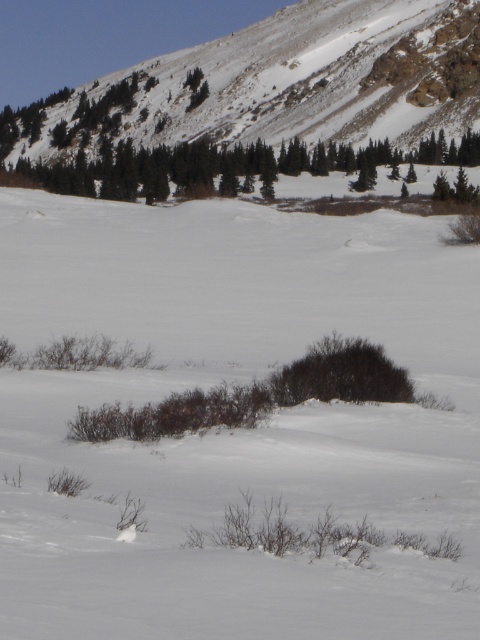
You are standing at the origin point in the winter landscape. You see two points marked in the scene, point 1 at coordinates point (2, 257) and point 2 at coordinates point (96, 81). Which point is closer to you?

Point (2, 257) is closer to you because it is in front of point (96, 81).

Consider the image. You are standing in the winter landscape described. You see a point labeled as point (x=235, y=429). What does this point represent?

The point (x=235, y=429) represents white fluffy snow at center.